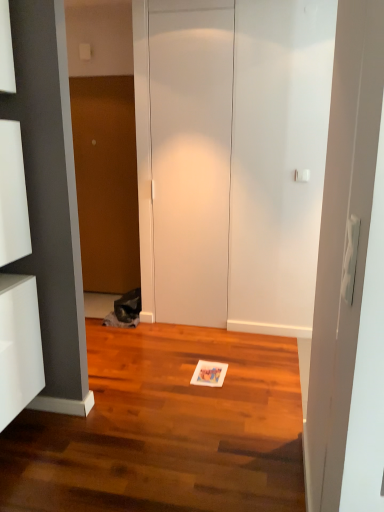
Identify the location of white glossy cabinet at left. (19, 346).

This screenshot has width=384, height=512. In order to click on wooden door at center, acting as the 2th door starting from the front in this screenshot , I will do `click(106, 181)`.

In the image, is white matte door at center, acting as the 1th door starting from the front, positioned in front of or behind wooden door at center, placed as the first door when sorted from back to front?

white matte door at center, acting as the 1th door starting from the front, is in front of wooden door at center, placed as the first door when sorted from back to front.

This screenshot has height=512, width=384. Identify the location of door in front of the wooden door at center, the second door when ordered from right to left. (191, 156).

Is white matte door at center, the 1th door when ordered from right to left, far from wooden door at center, the second door when ordered from right to left?

No.

How far apart are white matte door at center, the 2th door when ordered from back to front, and wooden door at center, the second door when ordered from right to left?

A distance of 35.38 inches exists between white matte door at center, the 2th door when ordered from back to front, and wooden door at center, the second door when ordered from right to left.

Considering the relative positions of wooden door at center, acting as the first door starting from the left, and white glossy cabinet at left in the image provided, is wooden door at center, acting as the first door starting from the left, to the left or to the right of white glossy cabinet at left?

From the image, it's evident that wooden door at center, acting as the first door starting from the left, is to the right of white glossy cabinet at left.

Does point (119, 188) appear closer or farther from the camera than point (30, 276)?

Point (119, 188) appears to be farther away from the viewer than point (30, 276).

Looking at this image, considering the sizes of objects wooden door at center, acting as the first door starting from the left, and white glossy cabinet at left in the image provided, who is thinner, wooden door at center, acting as the first door starting from the left, or white glossy cabinet at left?

wooden door at center, acting as the first door starting from the left, is thinner.

Is wooden door at center, acting as the 2th door starting from the front, aimed at white glossy cabinet at left?

Yes, wooden door at center, acting as the 2th door starting from the front, is turned towards white glossy cabinet at left.

Is white glossy cabinet at left at the back of white matte door at center, the 1th door when ordered from right to left?

That's not correct — white matte door at center, the 1th door when ordered from right to left, is not looking away from white glossy cabinet at left.

Is the surface of white matte door at center, acting as the 1th door starting from the front, in direct contact with white glossy cabinet at left?

There is a gap between white matte door at center, acting as the 1th door starting from the front, and white glossy cabinet at left.

Who is smaller, white matte door at center, which appears as the 2th door when viewed from the left, or white glossy cabinet at left?

white glossy cabinet at left.

Find the location of a particular element. cabinetry lying below the white matte door at center, acting as the 1th door starting from the front (from the image's perspective) is located at coordinates tap(19, 346).

Would you consider white glossy cabinet at left to be distant from white matte door at center, the 2th door when ordered from back to front?

white glossy cabinet at left is far away from white matte door at center, the 2th door when ordered from back to front.

Considering the positions of objects white glossy cabinet at left and white matte door at center, the 2th door when ordered from back to front, in the image provided, who is more to the left, white glossy cabinet at left or white matte door at center, the 2th door when ordered from back to front,?

white glossy cabinet at left is more to the left.

From a real-world perspective, is white glossy cabinet at left located higher than wooden door at center, acting as the 2th door starting from the front?

No, from a real-world perspective, white glossy cabinet at left is not above wooden door at center, acting as the 2th door starting from the front.

Is white glossy cabinet at left wider than wooden door at center, acting as the 2th door starting from the front?

Yes, white glossy cabinet at left is wider than wooden door at center, acting as the 2th door starting from the front.

Considering the relative sizes of white glossy cabinet at left and wooden door at center, placed as the first door when sorted from back to front, in the image provided, is white glossy cabinet at left shorter than wooden door at center, placed as the first door when sorted from back to front,?

Yes.

From the image's perspective, relative to wooden door at center, placed as the first door when sorted from back to front, is white glossy cabinet at left above or below?

Based on their image positions, white glossy cabinet at left is located beneath wooden door at center, placed as the first door when sorted from back to front.

Is wooden door at center, acting as the 2th door starting from the front, turned away from white matte door at center, the 1th door when ordered from right to left?

No, wooden door at center, acting as the 2th door starting from the front,'s orientation is not away from white matte door at center, the 1th door when ordered from right to left.

From a real-world perspective, is wooden door at center, the second door when ordered from right to left, on top of white matte door at center, the 2th door when ordered from back to front?

No.

Which object is closer to the camera taking this photo, wooden door at center, placed as the first door when sorted from back to front, or white matte door at center, which appears as the 2th door when viewed from the left?

white matte door at center, which appears as the 2th door when viewed from the left, is in front.

This screenshot has width=384, height=512. Identify the location of door located above the white matte door at center, the 2th door when ordered from back to front (from the image's perspective). (106, 181).

Identify the location of cabinetry below the wooden door at center, the second door when ordered from right to left (from a real-world perspective). The width and height of the screenshot is (384, 512). (19, 346).

When comparing their distances from white glossy cabinet at left, does white matte door at center, acting as the 1th door starting from the front, or wooden door at center, the second door when ordered from right to left, seem further?

Among the two, wooden door at center, the second door when ordered from right to left, is located further to white glossy cabinet at left.

Looking at the image, which one is located further to white glossy cabinet at left, wooden door at center, acting as the 2th door starting from the front, or white matte door at center, the 2th door when ordered from back to front?

The object further to white glossy cabinet at left is wooden door at center, acting as the 2th door starting from the front.

When comparing their distances from white matte door at center, the 2th door when ordered from back to front, does white glossy cabinet at left or wooden door at center, placed as the first door when sorted from back to front, seem further?

white glossy cabinet at left lies further to white matte door at center, the 2th door when ordered from back to front, than the other object.

Looking at the image, which one is located further to wooden door at center, the second door when ordered from right to left, white matte door at center, the 2th door when ordered from back to front, or white glossy cabinet at left?

white glossy cabinet at left is further to wooden door at center, the second door when ordered from right to left.

When comparing their distances from white matte door at center, which appears as the 2th door when viewed from the left, does wooden door at center, placed as the first door when sorted from back to front, or white glossy cabinet at left seem closer?

The object closer to white matte door at center, which appears as the 2th door when viewed from the left, is wooden door at center, placed as the first door when sorted from back to front.

Based on their spatial positions, is white glossy cabinet at left or white matte door at center, which appears as the 2th door when viewed from the left, further from wooden door at center, acting as the first door starting from the left?

Based on the image, white glossy cabinet at left appears to be further to wooden door at center, acting as the first door starting from the left.

In order to click on door located between white glossy cabinet at left and wooden door at center, placed as the first door when sorted from back to front, in the depth direction in this screenshot , I will do `click(191, 156)`.